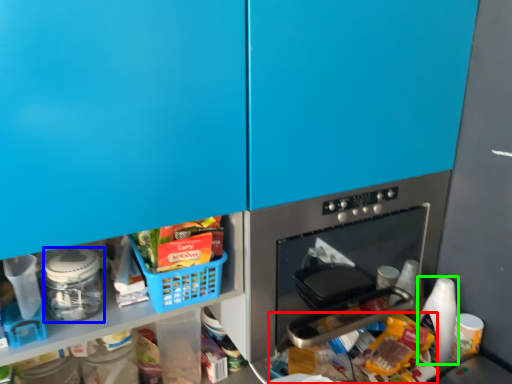
Question: Estimate the real-world distances between objects in this image. Which object is closer to food (highlighted by a red box), appliance (highlighted by a blue box) or bottle (highlighted by a green box)?

Choices:
 (A) appliance
 (B) bottle

Answer: (B)